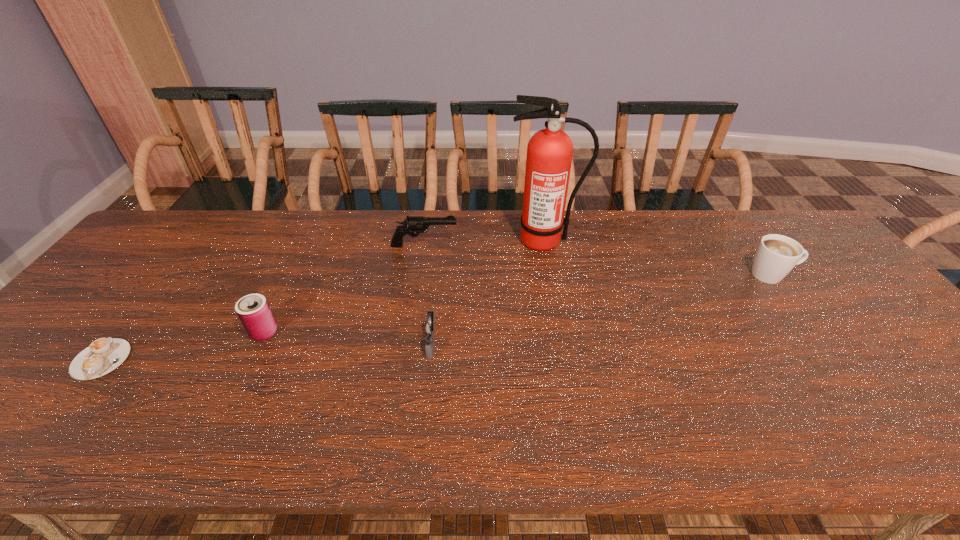
You are a GUI agent. You are given a task and a screenshot of the screen. Output one action in this format:
    pyautogui.click(x=<x>, y=<y>)
    Task: Click on the blank space located 0.380m at the end of the barrel of the gun
    
    Given the screenshot: What is the action you would take?
    pyautogui.click(x=579, y=245)

Where is `vacant space located with the handle on the side of the right cappuccino`? This screenshot has width=960, height=540. vacant space located with the handle on the side of the right cappuccino is located at coordinates (844, 274).

This screenshot has width=960, height=540. I want to click on vacant region located on the left of the igniter, so click(x=375, y=343).

Locate an element on the screen. The image size is (960, 540). vacant space located 0.330m on the right of the can is located at coordinates coord(409,332).

Locate an element on the screen. The width and height of the screenshot is (960, 540). vacant space located 0.170m on the right of the left cappuccino is located at coordinates (199, 360).

Where is `fire extinguisher located in the far edge section of the desktop`? This screenshot has width=960, height=540. fire extinguisher located in the far edge section of the desktop is located at coordinates [549, 152].

This screenshot has width=960, height=540. Identify the location of gun that is positioned at the far edge. (412, 224).

The image size is (960, 540). I want to click on object present at the left edge, so click(x=103, y=355).

Identify the location of object positioned at the right edge. The height and width of the screenshot is (540, 960). (776, 255).

In the image, there is a desktop. Identify the location of vacant space at the far edge. pos(304,210).